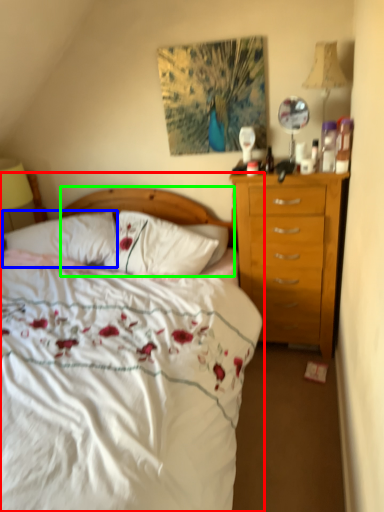
Question: Considering the real-world distances, which object is farthest from bed (highlighted by a red box)? pillow (highlighted by a blue box) or headboard (highlighted by a green box)?

Choices:
 (A) pillow
 (B) headboard

Answer: (B)